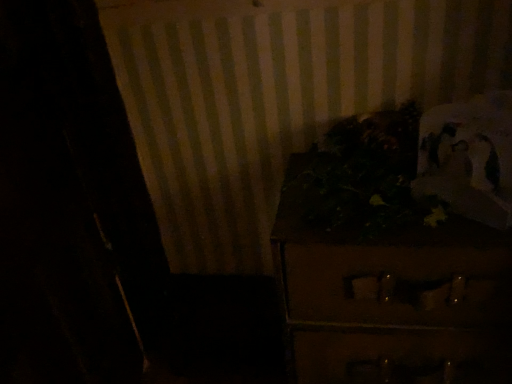
Describe the element at coordinates (392, 298) in the screenshot. I see `wooden chest of drawers at right` at that location.

The image size is (512, 384). I want to click on wooden chest of drawers at right, so click(392, 298).

Locate an element on the screen. wooden chest of drawers at right is located at coordinates (392, 298).